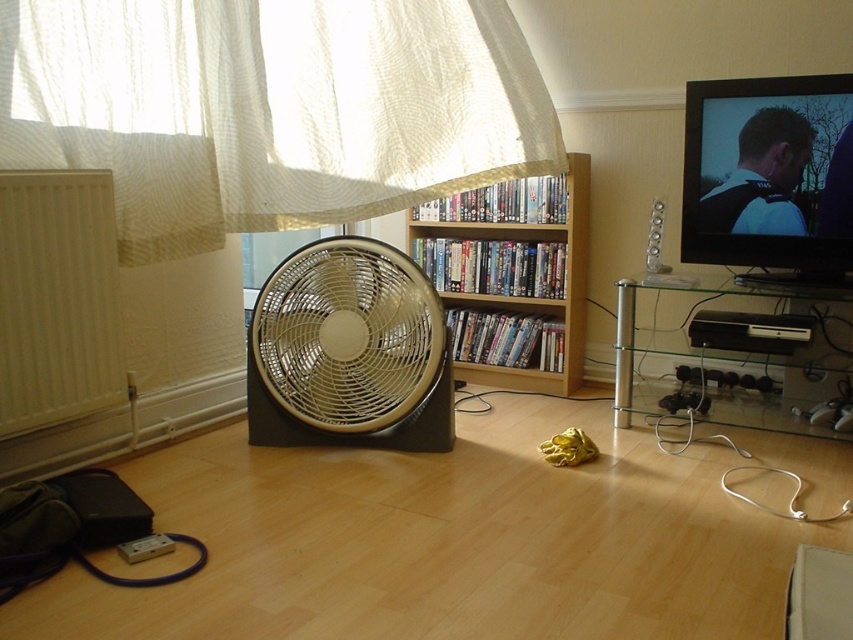
Between matte silver fan at center and black plastic speaker at right, which one is positioned higher?

black plastic speaker at right is higher up.

Is matte silver fan at center smaller than black plastic speaker at right?

Incorrect, matte silver fan at center is not smaller in size than black plastic speaker at right.

Locate an element on the screen. The height and width of the screenshot is (640, 853). matte silver fan at center is located at coordinates (349, 352).

The image size is (853, 640). Find the location of `matte silver fan at center`. matte silver fan at center is located at coordinates (349, 352).

Can you confirm if white sheer curtain at upper left is thinner than matte silver fan at center?

No, white sheer curtain at upper left is not thinner than matte silver fan at center.

How distant is white sheer curtain at upper left from matte silver fan at center?

white sheer curtain at upper left is 20.51 inches from matte silver fan at center.

I want to click on white sheer curtain at upper left, so click(x=270, y=108).

Locate an element on the screen. Image resolution: width=853 pixels, height=640 pixels. white sheer curtain at upper left is located at coordinates pyautogui.click(x=270, y=108).

Can you confirm if matte silver fan at center is taller than white matte radiator at left?

Yes.

Which is in front, point (323, 410) or point (35, 214)?

Point (35, 214) is more forward.

Which is in front, point (416, 314) or point (79, 416)?

Positioned in front is point (79, 416).

At what (x,y) coordinates should I click in order to perform the action: click on matte silver fan at center. Please return your answer as a coordinate pair (x, y). Looking at the image, I should click on (349, 352).